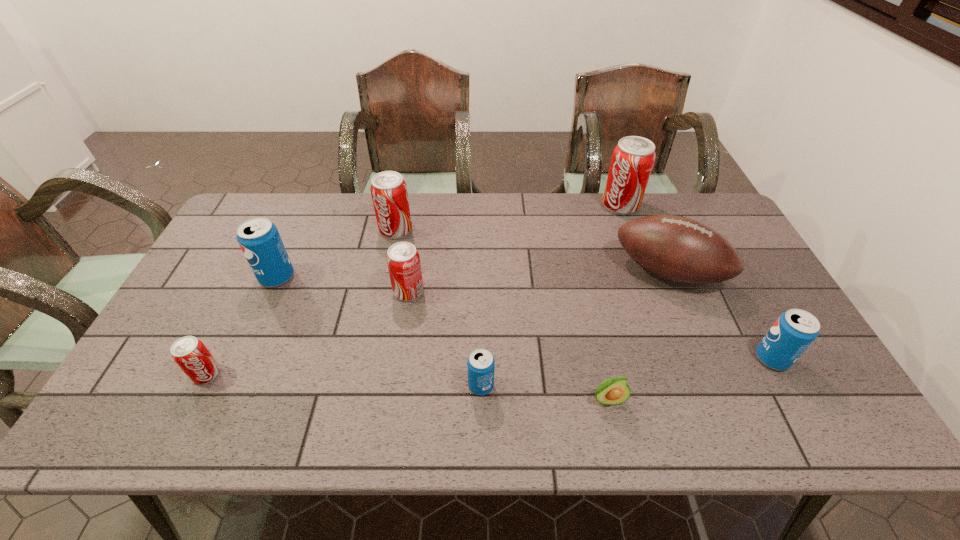
Image resolution: width=960 pixels, height=540 pixels. Find the location of `the nearest red soda can`. the nearest red soda can is located at coordinates (190, 354).

I want to click on the leftmost red soda can, so [190, 354].

Identify the location of the fifth soda can from left to right. This screenshot has height=540, width=960. (x=480, y=364).

Where is `the fifth object from right to left`? the fifth object from right to left is located at coordinates (480, 364).

I want to click on the fourth object from right to left, so click(613, 391).

Identify the location of green avocado. (613, 391).

Identify the location of blank area located 0.210m on the front of the farthest red soda can. (640, 260).

What are the coordinates of `free point located 0.150m on the back of the farthest blue soda can` in the screenshot? It's located at (297, 233).

At what (x,y) coordinates should I click in order to perform the action: click on vacant space located 0.290m on the right of the second farthest object. Please return your answer as a coordinate pair (x, y). Looking at the image, I should click on (501, 230).

Identify the location of free space located 0.140m on the left of the football (American). (569, 272).